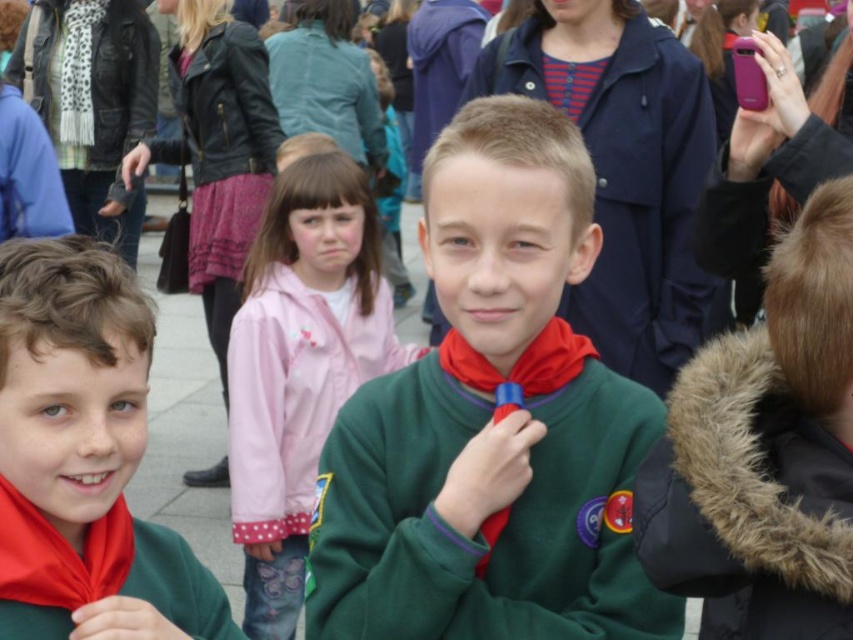
You are a photographer trying to capture the two boys in green uniforms. You notice a point at coordinates (491, 422). Based on the scene, which object is this point located on?

The point at coordinates (491, 422) is located on the green fleece sweater at center.

You are standing at the point labeled point (x=358, y=236) and want to move to the point labeled point (x=515, y=586). Is there a clear path between these two points without any obstacles?

Yes, since point (x=515, y=586) is in front of point (x=358, y=236), there is a clear path between them without obstacles.

You are organizing a clothing rack and need to arrange the green fleece sweater at center and the matte green sweater at center based on their positions in the image. Which sweater should be placed to the left of the other?

The matte green sweater at center should be placed to the left of the green fleece sweater at center because in the image, the green fleece sweater at center is positioned on the right side of the matte green sweater at center.